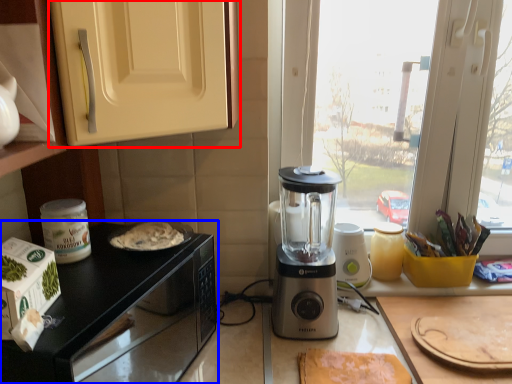
Question: Which of the following is the closest to the observer, cabinetry (highlighted by a red box) or countertop (highlighted by a blue box)?

Choices:
 (A) cabinetry
 (B) countertop

Answer: (A)